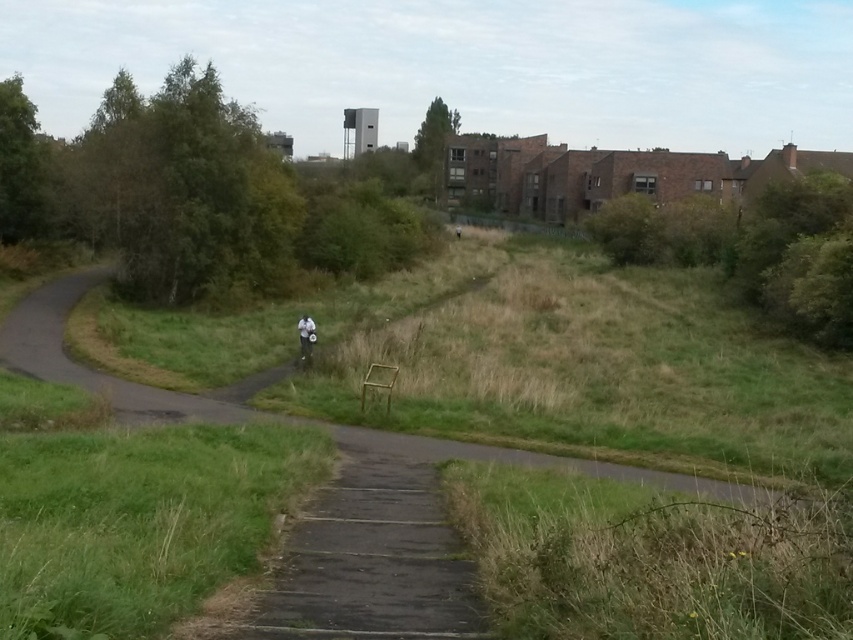
Can you confirm if green leafy tree at upper left is positioned below green leafy tree at upper center?

Yes, green leafy tree at upper left is below green leafy tree at upper center.

Does green leafy tree at upper left have a greater height compared to green leafy tree at upper center?

Incorrect, green leafy tree at upper left's height is not larger of green leafy tree at upper center's.

This screenshot has height=640, width=853. I want to click on green leafy tree at upper left, so click(x=193, y=196).

You are a GUI agent. You are given a task and a screenshot of the screen. Output one action in this format:
    pyautogui.click(x=<x>, y=<y>)
    Task: Click on the green leafy tree at upper left
    The width and height of the screenshot is (853, 640).
    Given the screenshot: What is the action you would take?
    point(193,196)

Can you confirm if green leafy tree at upper left is positioned to the right of white matte person at center?

Incorrect, green leafy tree at upper left is not on the right side of white matte person at center.

Does green leafy tree at upper left have a smaller size compared to white matte person at center?

Actually, green leafy tree at upper left might be larger than white matte person at center.

Is point (125, 294) farther from camera compared to point (314, 324)?

Yes, point (125, 294) is farther from viewer.

Find the location of a particular element. The width and height of the screenshot is (853, 640). green leafy tree at upper left is located at coordinates click(x=193, y=196).

Between green grassy bush at right and green leafy tree at upper center, which one is positioned higher?

green leafy tree at upper center is higher up.

Is green grassy bush at right below green leafy tree at upper center?

Yes.

Is point (838, 252) more distant than point (456, 124)?

No, (838, 252) is in front of (456, 124).

Find the location of a particular element. Image resolution: width=853 pixels, height=640 pixels. green grassy bush at right is located at coordinates (753, 248).